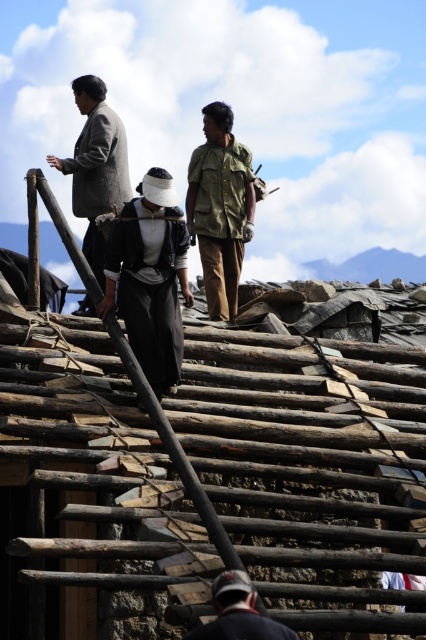
You are a safety inspector evaluating the roof scene. You need to ensure that the dark gray fabric construction worker at center and the matte khaki shirt at center are within a safe distance from the edge of the roof. Which worker should you advise to move further away if the safe distance is measured from their closest edge?

The dark gray fabric construction worker at center has a larger width than the matte khaki shirt at center, so their closest edge to the roof edge would be farther away if they are positioned similarly. However, since the question is about advising to move further away based on their widths, the worker with the smaller width, the matte khaki shirt at center, might be closer to the edge and thus needs to move back to maintain the safe distance.

You are a safety inspector on the roof. You need to ensure that the dark gray fabric construction worker at center and the matte khaki shirt at center are maintaining a safe distance of at least 30 feet apart. Based on the scene, are they compliant with the safety regulations?

The dark gray fabric construction worker at center is 41.01 feet from matte khaki shirt at center, so they are compliant with the safety regulations as the distance exceeds the required 30 feet.